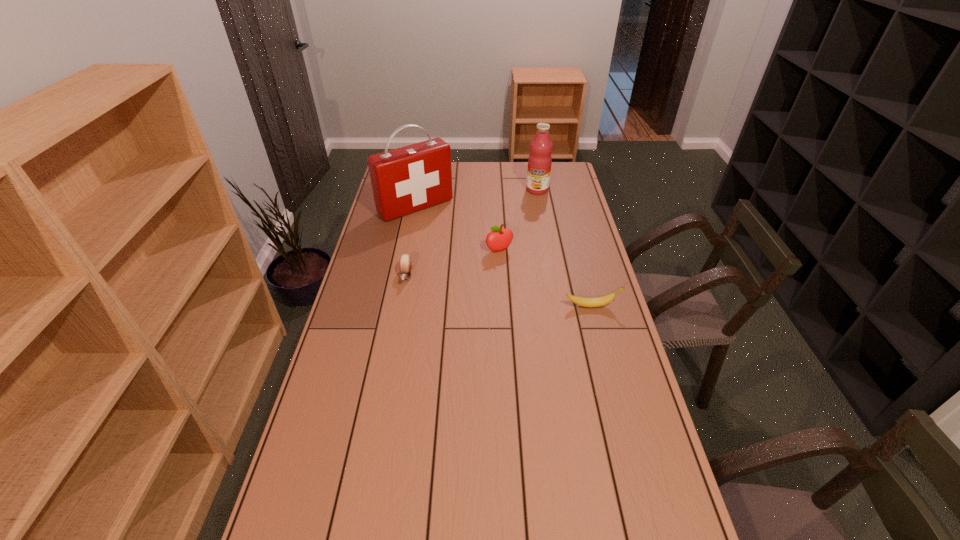
Where is `vacant space located 0.180m on the label of the fruit juice`? vacant space located 0.180m on the label of the fruit juice is located at coordinates (525, 216).

Find the location of `vacant space located on the label of the fruit juice`. vacant space located on the label of the fruit juice is located at coordinates (522, 221).

Where is `free space located 0.260m on the front-facing side of the third shortest object`? free space located 0.260m on the front-facing side of the third shortest object is located at coordinates (524, 300).

You are a GUI agent. You are given a task and a screenshot of the screen. Output one action in this format:
    pyautogui.click(x=<x>, y=<y>)
    Task: Click on the vacant area located 0.370m on the front-facing side of the third shortest object
    Image resolution: width=960 pixels, height=540 pixels.
    Given the screenshot: What is the action you would take?
    pyautogui.click(x=535, y=323)

Identify the location of free space located on the front-facing side of the third shortest object. (537, 327).

Image resolution: width=960 pixels, height=540 pixels. In order to click on free spot located on the front face of the tallest object in this screenshot , I will do `click(444, 231)`.

I want to click on free space located on the front face of the tallest object, so click(x=479, y=266).

Find the location of `blank space located 0.180m on the front face of the tallest object`. blank space located 0.180m on the front face of the tallest object is located at coordinates (455, 242).

At what (x,y) coordinates should I click in order to perform the action: click on object present at the far edge. Please return your answer as a coordinate pair (x, y). This screenshot has height=540, width=960. Looking at the image, I should click on (539, 162).

Find the location of `escargot positioned at the left edge`. escargot positioned at the left edge is located at coordinates (405, 262).